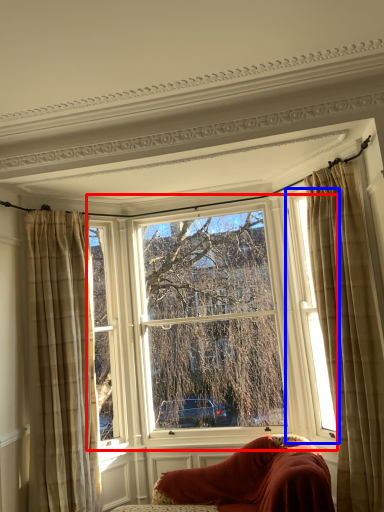
Question: Which point is further to the camera, window (highlighted by a red box) or window (highlighted by a blue box)?

Choices:
 (A) window
 (B) window

Answer: (A)